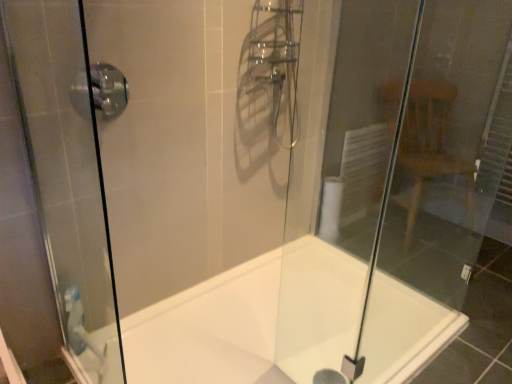
Question: Is satin chrome shower handle at upper left not near white glossy bathtub at center?

Choices:
 (A) no
 (B) yes

Answer: (B)

Question: Can you confirm if satin chrome shower handle at upper left is wider than white glossy bathtub at center?

Choices:
 (A) no
 (B) yes

Answer: (A)

Question: Is satin chrome shower handle at upper left in contact with white glossy bathtub at center?

Choices:
 (A) no
 (B) yes

Answer: (A)

Question: From a real-world perspective, is satin chrome shower handle at upper left on white glossy bathtub at center?

Choices:
 (A) yes
 (B) no

Answer: (A)

Question: Considering the relative sizes of satin chrome shower handle at upper left and white glossy bathtub at center in the image provided, is satin chrome shower handle at upper left shorter than white glossy bathtub at center?

Choices:
 (A) no
 (B) yes

Answer: (A)

Question: Is satin chrome shower handle at upper left to the left of white glossy bathtub at center from the viewer's perspective?

Choices:
 (A) no
 (B) yes

Answer: (B)

Question: From the image's perspective, is satin chrome shower handle at upper left on transparent glass door at right?

Choices:
 (A) yes
 (B) no

Answer: (A)

Question: Considering the relative sizes of satin chrome shower handle at upper left and transparent glass door at right in the image provided, is satin chrome shower handle at upper left thinner than transparent glass door at right?

Choices:
 (A) no
 (B) yes

Answer: (A)

Question: Does satin chrome shower handle at upper left touch transparent glass door at right?

Choices:
 (A) no
 (B) yes

Answer: (A)

Question: Is transparent glass door at right located within satin chrome shower handle at upper left?

Choices:
 (A) yes
 (B) no

Answer: (B)

Question: Can we say satin chrome shower handle at upper left lies outside transparent glass door at right?

Choices:
 (A) yes
 (B) no

Answer: (A)

Question: Is satin chrome shower handle at upper left closer to camera compared to transparent glass door at right?

Choices:
 (A) no
 (B) yes

Answer: (B)

Question: Is transparent glass shower door at left not within white glossy bathtub at center?

Choices:
 (A) yes
 (B) no

Answer: (A)